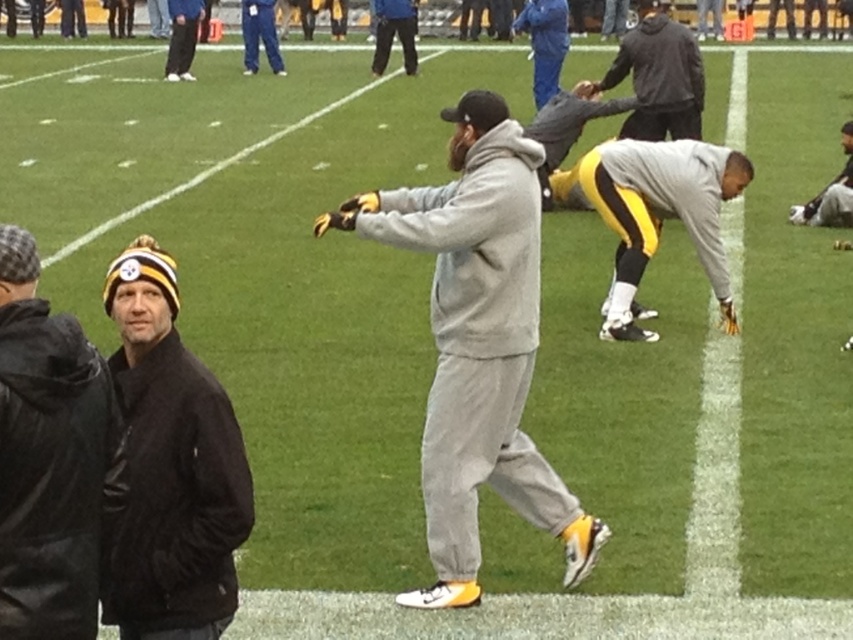
Question: Observing the image, what is the correct spatial positioning of black leather jacket at left in reference to gray/black athletic pants at center?

Choices:
 (A) right
 (B) left

Answer: (B)

Question: Is yellow knit beanie at left wider than gray/black athletic pants at center?

Choices:
 (A) no
 (B) yes

Answer: (A)

Question: Which point is closer to the camera taking this photo?

Choices:
 (A) (32, 528)
 (B) (154, 570)
 (C) (194, 44)

Answer: (A)

Question: Which object is positioned closest to the white painted line at center?

Choices:
 (A) gray fleece jacket at center
 (B) black leather jacket at left
 (C) yellow knit beanie at left
 (D) dark gray hoodie at center

Answer: (D)

Question: Can you confirm if yellow-black uniform at right is thinner than blue denim pants at upper center?

Choices:
 (A) yes
 (B) no

Answer: (A)

Question: Which object is farther from the camera taking this photo?

Choices:
 (A) gray fleece jacket at center
 (B) dark gray hoodie at center

Answer: (B)